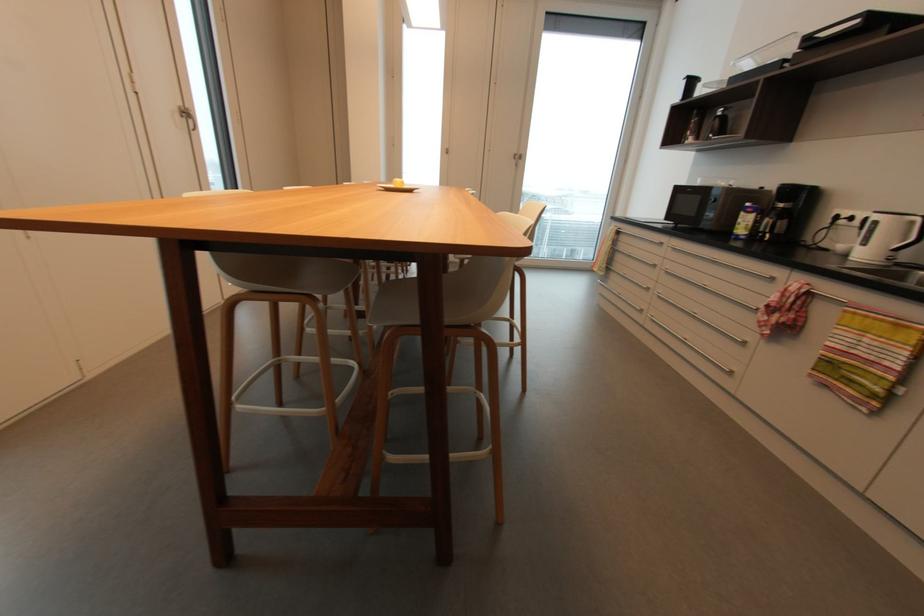
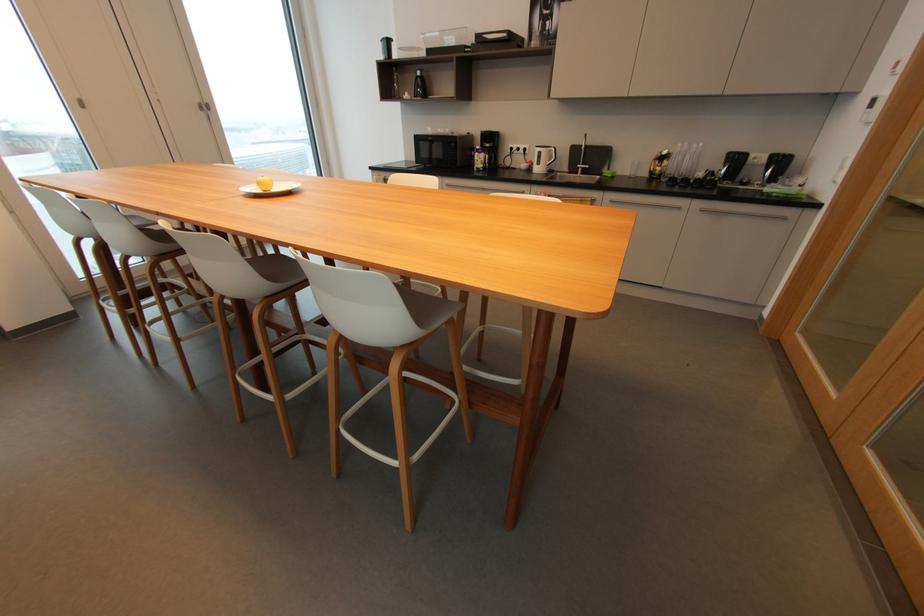
The point at (448, 151) is marked in the first image. Where is the corresponding point in the second image?

(81, 103)